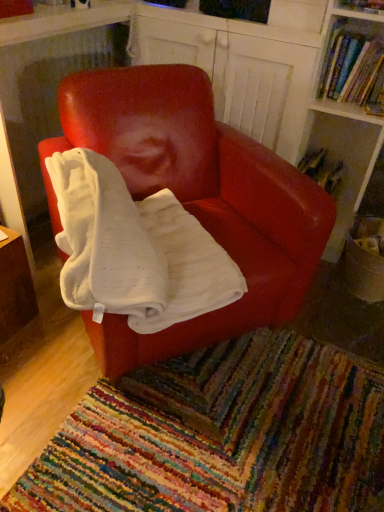
Identify the location of free spot above multicolored woven mat at lower center (from a real-world perspective). This screenshot has width=384, height=512. [235, 426].